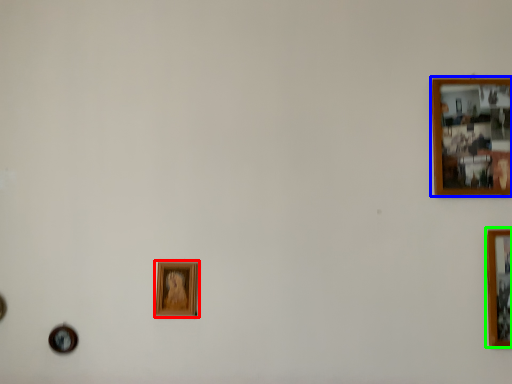
Question: Considering the real-world distances, which object is closest to picture frame (highlighted by a red box)? picture frame (highlighted by a blue box) or picture frame (highlighted by a green box).

Choices:
 (A) picture frame
 (B) picture frame

Answer: (A)